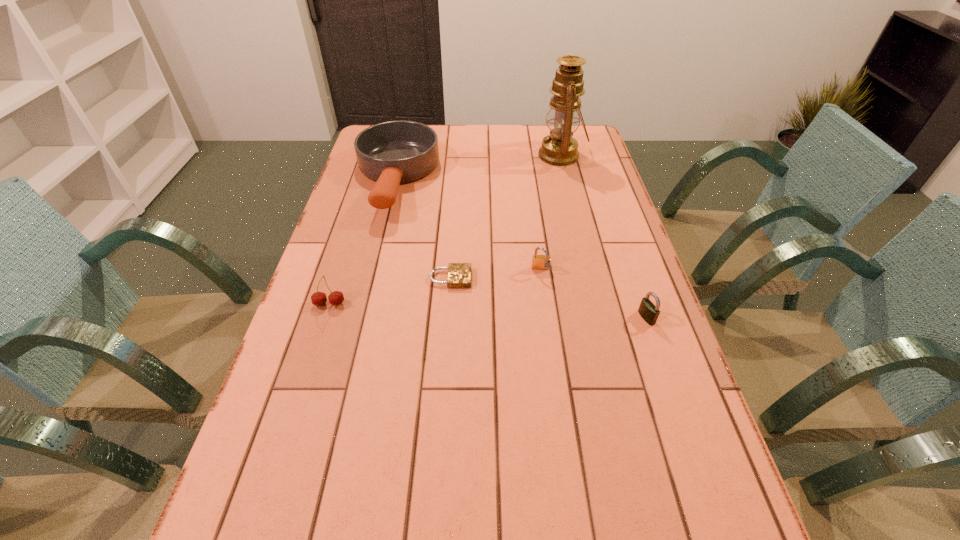
In order to click on unoccupied area between the cherry and the second padlock from left to right in this screenshot , I will do `click(435, 287)`.

Where is `free spot between the cherry and the second padlock from left to right`? The height and width of the screenshot is (540, 960). free spot between the cherry and the second padlock from left to right is located at coordinates (435, 287).

The height and width of the screenshot is (540, 960). Find the location of `blank region between the shortest padlock and the nearest padlock`. blank region between the shortest padlock and the nearest padlock is located at coordinates (548, 298).

The image size is (960, 540). I want to click on free space that is in between the nearest padlock and the second object from right to left, so click(x=604, y=237).

Image resolution: width=960 pixels, height=540 pixels. Find the location of `free space that is in between the second padlock from right to left and the pan`. free space that is in between the second padlock from right to left and the pan is located at coordinates (468, 225).

Point out which object is positioned as the second nearest to the fourth object from left to right. Please provide its 2D coordinates. Your answer should be formatted as a tuple, i.e. [(x, y)], where the tuple contains the x and y coordinates of a point satisfying the conditions above.

[(648, 311)]

Where is `object that is the fifth nearest to the pan`? The height and width of the screenshot is (540, 960). object that is the fifth nearest to the pan is located at coordinates (648, 311).

Identify which padlock is located as the nearest to the oil lamp. Please provide its 2D coordinates. Your answer should be formatted as a tuple, i.e. [(x, y)], where the tuple contains the x and y coordinates of a point satisfying the conditions above.

[(539, 262)]

At what (x,y) coordinates should I click in order to perform the action: click on padlock that is the second closest to the third object from right to left. Please return your answer as a coordinate pair (x, y). The width and height of the screenshot is (960, 540). Looking at the image, I should click on (648, 311).

I want to click on free region that satisfies the following two spatial constraints: 1. on the surface of the nearest padlock; 2. on the right side of the cherry, so click(325, 318).